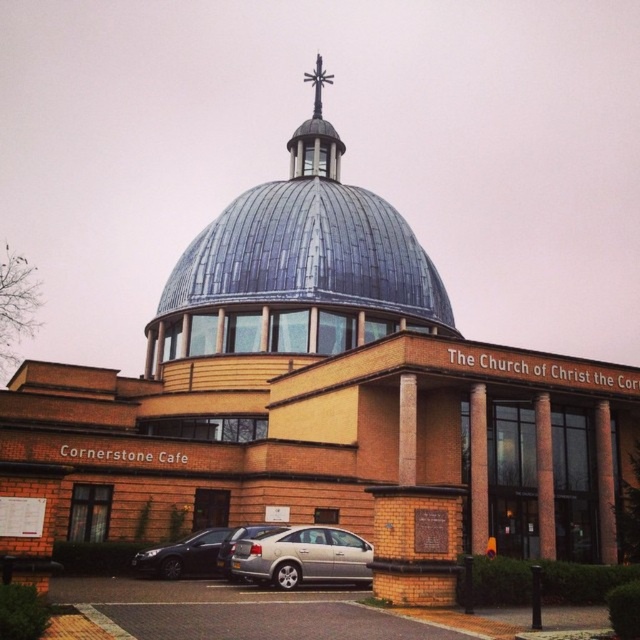
Can you confirm if metallic blue dome at center is positioned to the left of silver metallic car at lower center?

No, metallic blue dome at center is not to the left of silver metallic car at lower center.

Is point (301, 188) farther from viewer compared to point (310, 534)?

Yes, point (301, 188) is farther from viewer.

Describe the element at coordinates (298, 269) in the screenshot. This screenshot has width=640, height=640. I see `metallic blue dome at center` at that location.

Identify the location of metallic blue dome at center. The image size is (640, 640). (298, 269).

Is silver metallic car at lower center closer to the viewer compared to polished metal cross at upper center?

That is True.

Can you confirm if silver metallic car at lower center is positioned to the left of polished metal cross at upper center?

Correct, you'll find silver metallic car at lower center to the left of polished metal cross at upper center.

I want to click on silver metallic car at lower center, so click(301, 556).

Is point (372, 308) positioned behind point (221, 544)?

Yes, it is behind point (221, 544).

Is metallic blue dome at center positioned behind silver metallic sedan at center?

Yes, it is.

In order to click on metallic blue dome at center in this screenshot , I will do `click(298, 269)`.

The image size is (640, 640). Identify the location of metallic blue dome at center. (298, 269).